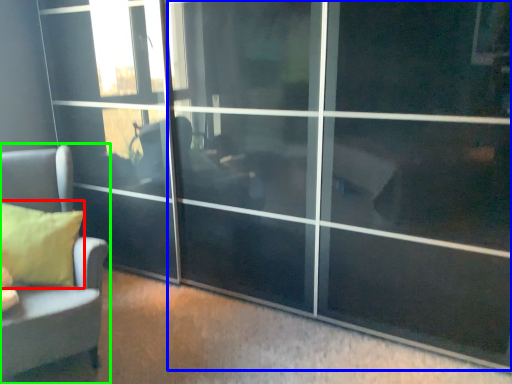
Question: Which object is positioned closest to pillow (highlighted by a red box)? Select from screen door (highlighted by a blue box) and furniture (highlighted by a green box).

Choices:
 (A) screen door
 (B) furniture

Answer: (B)